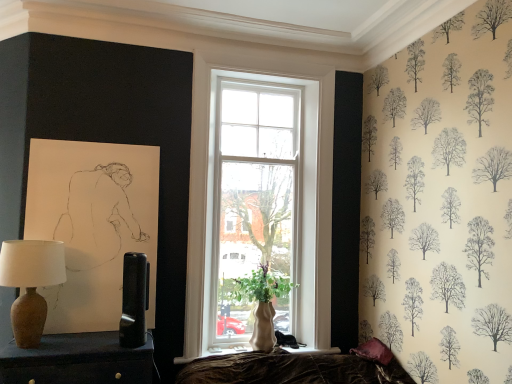
The image size is (512, 384). Identify the location of free location above matte black table lamp at center, which is counted as the first table lamp, starting from the right (from a real-world perspective). (136, 256).